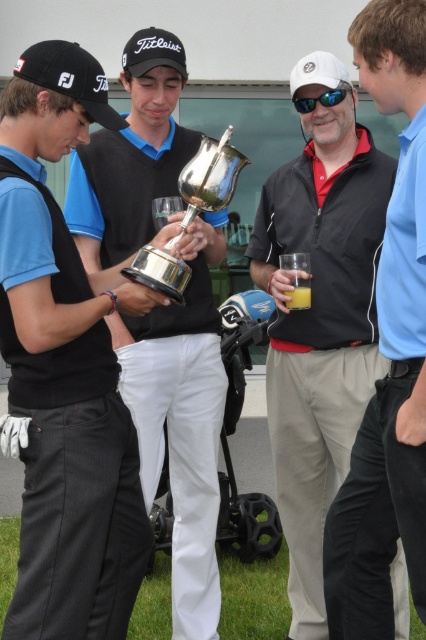
Question: Which point is farther to the camera?

Choices:
 (A) (394, 22)
 (B) (301, 108)
 (C) (336, 385)
 (D) (123, 64)

Answer: (B)

Question: Does green grass at lower left appear on the left side of white matte baseball cap at upper center?

Choices:
 (A) yes
 (B) no

Answer: (A)

Question: Based on their relative distances, which object is nearer to the black fabric baseball cap at left?

Choices:
 (A) sunglasses at center
 (B) green grass at lower left
 (C) black matte jacket at center

Answer: (A)

Question: Does green grass at lower left come behind black fabric baseball cap at left?

Choices:
 (A) yes
 (B) no

Answer: (A)

Question: Is titleist matte black cap at upper center positioned at the back of white matte baseball cap at upper center?

Choices:
 (A) no
 (B) yes

Answer: (A)

Question: Among these points, which one is nearest to the camera?

Choices:
 (A) (321, 80)
 (B) (63, 72)

Answer: (B)